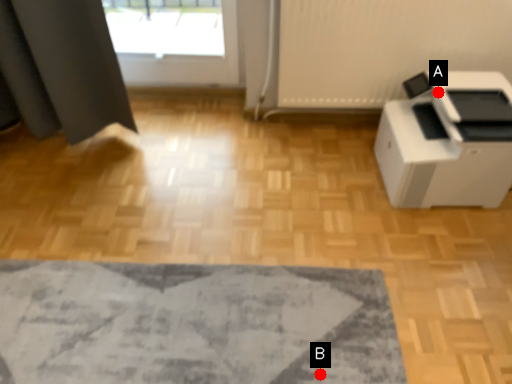
Question: Two points are circled on the image, labeled by A and B beside each circle. Which of the following is the farthest from the observer?

Choices:
 (A) A is further
 (B) B is further

Answer: (A)